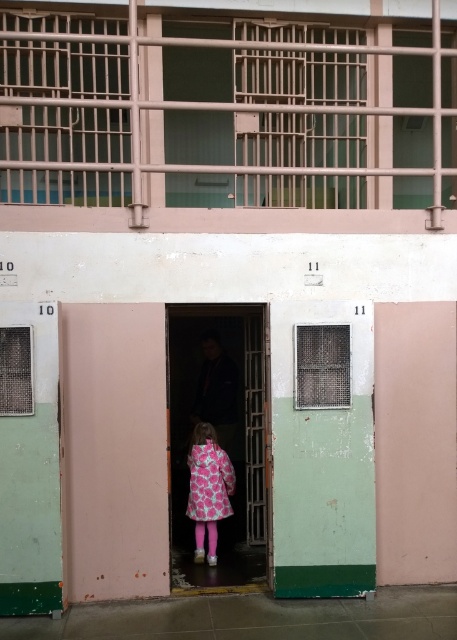
You are a security guard at the entrance of the cell block and need to check the width of the pink fabric coat at center and the pink floral fabric dress at center. Which one is wider?

The pink fabric coat at center is wider than the pink floral fabric dress at center according to the description.

You are a security guard in the cell block entrance. You see a pink fabric coat at center and a pink floral fabric dress at center hanging on a rack. Which clothing item is closer to you?

The pink fabric coat at center is closer to you because it is in front of the pink floral fabric dress at center.